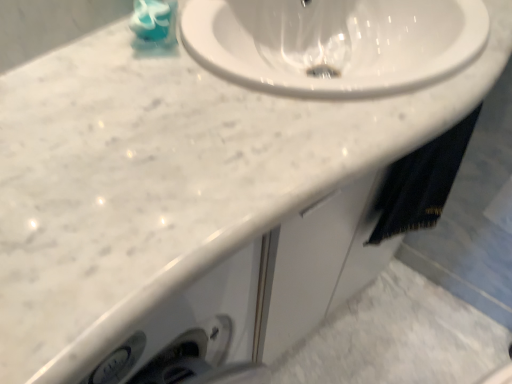
Identify the location of vacant region to the left of teal glossy soap at upper left. (88, 49).